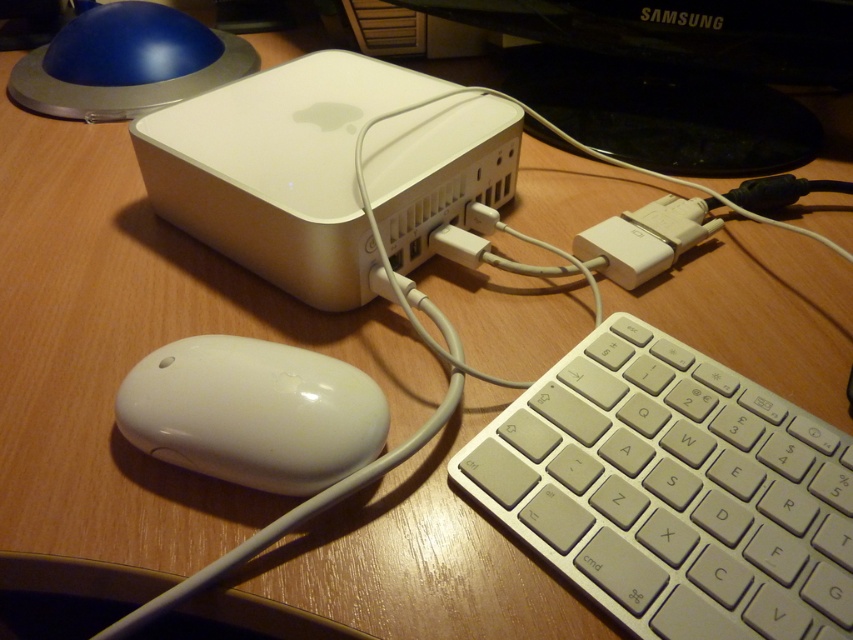
Question: Among these objects, which one is nearest to the camera?

Choices:
 (A) white plastic keyboard at lower right
 (B) black glossy monitor at upper center

Answer: (A)

Question: Which object is farther from the camera taking this photo?

Choices:
 (A) white glossy mouse at lower left
 (B) white plastic keyboard at lower right
 (C) white plastic plug at center right

Answer: (C)

Question: Does white plastic keyboard at lower right appear under black glossy monitor at upper center?

Choices:
 (A) yes
 (B) no

Answer: (A)

Question: Based on their relative distances, which object is nearer to the white plastic keyboard at lower right?

Choices:
 (A) black glossy monitor at upper center
 (B) white glossy mouse at lower left

Answer: (B)

Question: Is white plastic keyboard at lower right further to the viewer compared to white glossy mouse at lower left?

Choices:
 (A) yes
 (B) no

Answer: (B)

Question: Can you confirm if white plastic keyboard at lower right is positioned below black glossy monitor at upper center?

Choices:
 (A) no
 (B) yes

Answer: (B)